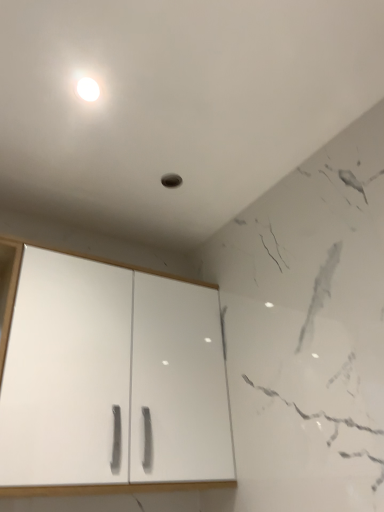
Question: Considering the relative sizes of white glossy light at upper center and white matte cabinet at center in the image provided, is white glossy light at upper center thinner than white matte cabinet at center?

Choices:
 (A) yes
 (B) no

Answer: (A)

Question: Is white glossy light at upper center wider than white matte cabinet at center?

Choices:
 (A) yes
 (B) no

Answer: (B)

Question: Does white glossy light at upper center turn towards white matte cabinet at center?

Choices:
 (A) no
 (B) yes

Answer: (A)

Question: Is white glossy light at upper center positioned beyond the bounds of white matte cabinet at center?

Choices:
 (A) yes
 (B) no

Answer: (A)

Question: From the image's perspective, would you say white glossy light at upper center is shown under white matte cabinet at center?

Choices:
 (A) yes
 (B) no

Answer: (B)

Question: Are white glossy light at upper center and white matte cabinet at center located far from each other?

Choices:
 (A) yes
 (B) no

Answer: (B)

Question: Is white matte cabinet at center shorter than white glossy light at upper center?

Choices:
 (A) yes
 (B) no

Answer: (B)

Question: Does white matte cabinet at center appear on the left side of white glossy light at upper center?

Choices:
 (A) no
 (B) yes

Answer: (A)

Question: Is white matte cabinet at center closer to camera compared to white glossy light at upper center?

Choices:
 (A) yes
 (B) no

Answer: (A)

Question: Could you tell me if white matte cabinet at center is facing white glossy light at upper center?

Choices:
 (A) yes
 (B) no

Answer: (B)

Question: From the image's perspective, is white matte cabinet at center beneath white glossy light at upper center?

Choices:
 (A) yes
 (B) no

Answer: (A)

Question: Would you say white matte cabinet at center is outside white glossy light at upper center?

Choices:
 (A) yes
 (B) no

Answer: (A)

Question: Considering the positions of point (82, 75) and point (29, 295), is point (82, 75) closer or farther from the camera than point (29, 295)?

Choices:
 (A) farther
 (B) closer

Answer: (B)